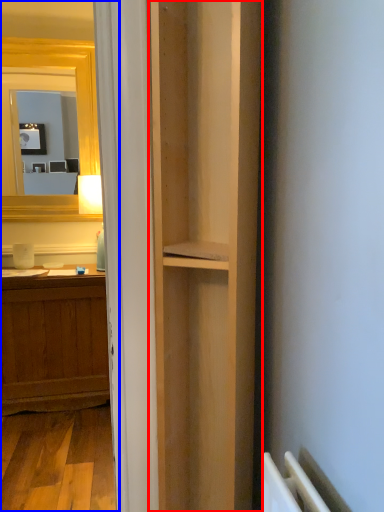
Question: Which object is further to the camera taking this photo, bookshelf (highlighted by a red box) or corridor (highlighted by a blue box)?

Choices:
 (A) bookshelf
 (B) corridor

Answer: (B)